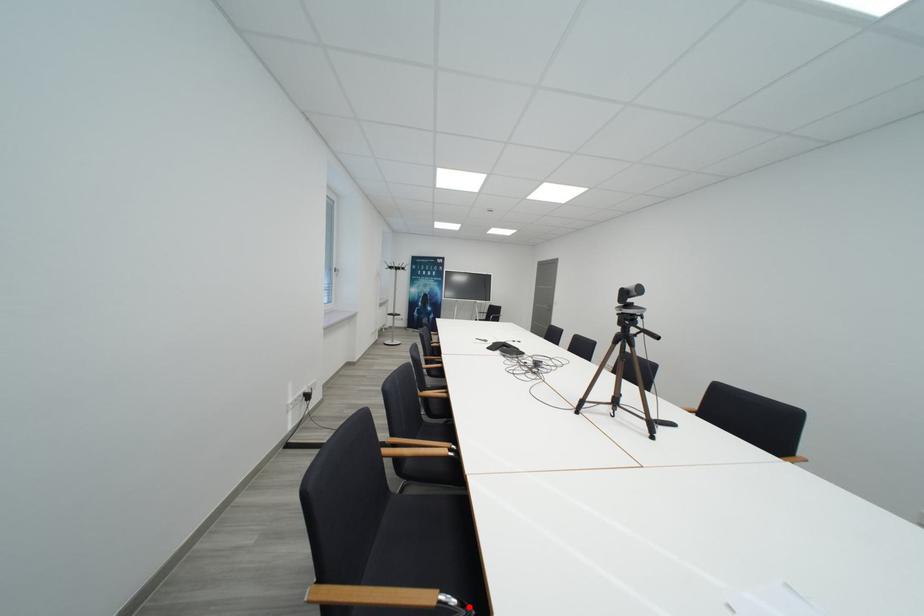
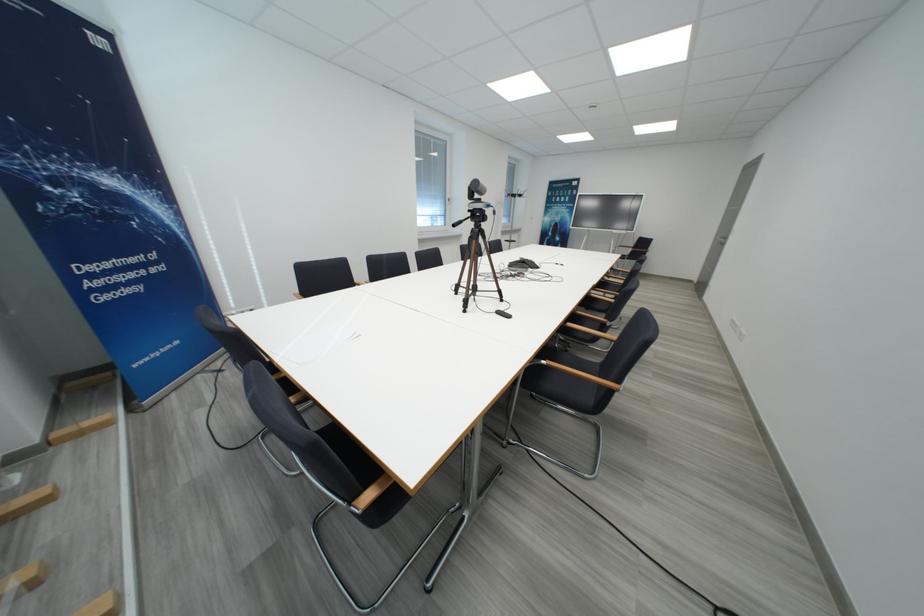
Question: I am providing you with two images of the same scene from different viewpoints. A red point is marked on the first image. Is the red point's position out of view in image 2?

Choices:
 (A) Yes
 (B) No

Answer: (A)